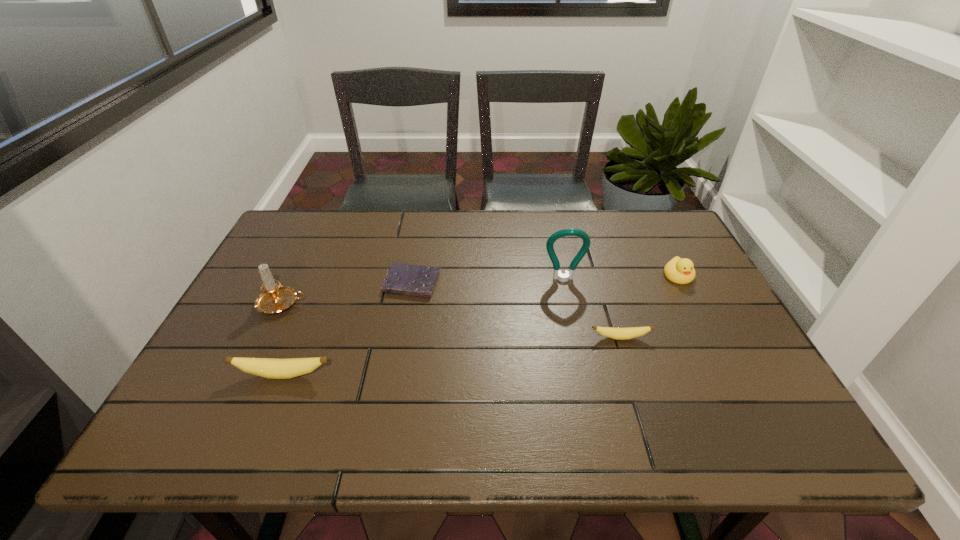
Locate an element on the screen. The height and width of the screenshot is (540, 960). free space that satisfies the following two spatial constraints: 1. at the jaws of the tallest object; 2. on the left side of the fifth farthest object is located at coordinates (576, 338).